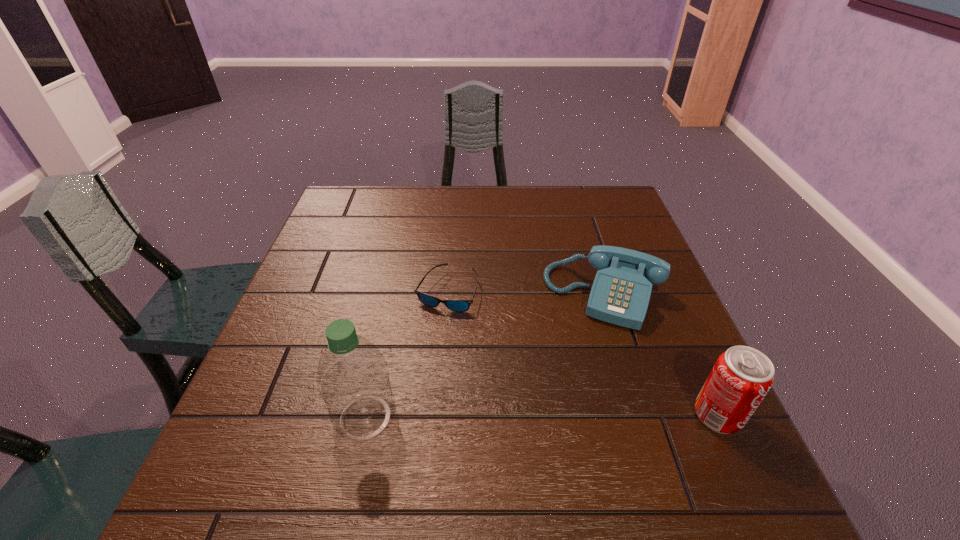
The height and width of the screenshot is (540, 960). In the image, there is a desktop. In order to click on vacant space at the near edge in this screenshot , I will do `click(490, 442)`.

At what (x,y) coordinates should I click in order to perform the action: click on blank space at the left edge. Please return your answer as a coordinate pair (x, y). Looking at the image, I should click on (362, 267).

This screenshot has width=960, height=540. Identify the location of free space at the right edge. (624, 239).

In order to click on vacant space at the far left corner in this screenshot , I will do coord(352,191).

This screenshot has width=960, height=540. Identify the location of unoccupied area between the third shortest object and the sunglasses. (583, 353).

The width and height of the screenshot is (960, 540). What are the coordinates of `free space between the soda can and the shortest object` in the screenshot? It's located at (583, 353).

Locate an element on the screen. empty location between the second tallest object and the second object from left to right is located at coordinates (583, 353).

Image resolution: width=960 pixels, height=540 pixels. Find the location of `free spot between the soda can and the third object from right to left`. free spot between the soda can and the third object from right to left is located at coordinates (583, 353).

Where is `free spot between the second shortest object and the third object from right to left`? free spot between the second shortest object and the third object from right to left is located at coordinates (526, 293).

Locate an element on the screen. This screenshot has width=960, height=540. vacant area that lies between the third tallest object and the leftmost object is located at coordinates (485, 356).